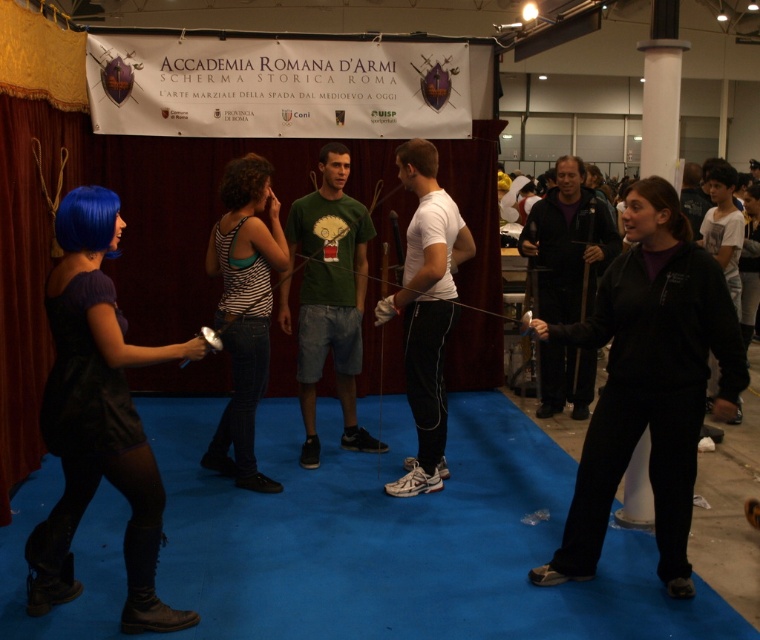
Is green cotton t-shirt at center thinner than dark gray fabric jacket at right?

Incorrect, green cotton t-shirt at center's width is not less than dark gray fabric jacket at right's.

How distant is green cotton t-shirt at center from dark gray fabric jacket at right?

The distance of green cotton t-shirt at center from dark gray fabric jacket at right is 1.61 meters.

Does point (309, 320) come closer to viewer compared to point (581, 378)?

Yes, it is in front of point (581, 378).

Locate an element on the screen. green cotton t-shirt at center is located at coordinates (328, 298).

How much distance is there between white matte t-shirt at center and dark gray fabric jacket at right?

white matte t-shirt at center is 1.42 meters away from dark gray fabric jacket at right.

Does point (435, 154) come behind point (551, 310)?

No, it is in front of (551, 310).

This screenshot has height=640, width=760. What are the coordinates of `white matte t-shirt at center` in the screenshot? It's located at (426, 310).

The image size is (760, 640). I want to click on white matte t-shirt at center, so click(426, 310).

Does green cotton t-shirt at center have a lesser width compared to white matte t-shirt at center?

In fact, green cotton t-shirt at center might be wider than white matte t-shirt at center.

Which is below, green cotton t-shirt at center or white matte t-shirt at center?

white matte t-shirt at center

Who is more distant from viewer, (363, 268) or (439, 330)?

Point (363, 268)

You are a GUI agent. You are given a task and a screenshot of the screen. Output one action in this format:
    pyautogui.click(x=<x>, y=<y>)
    Task: Click on the green cotton t-shirt at center
    This screenshot has height=640, width=760.
    Given the screenshot: What is the action you would take?
    pyautogui.click(x=328, y=298)